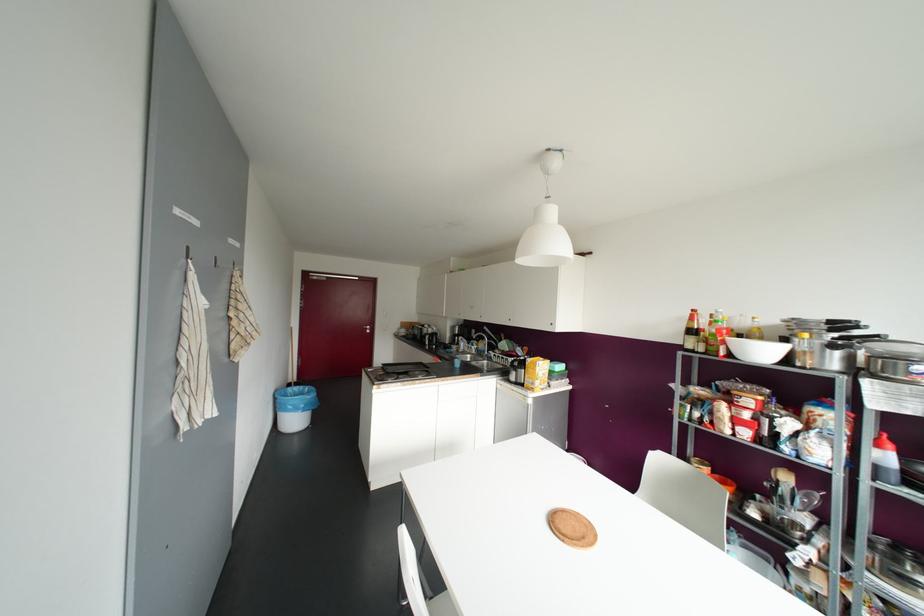
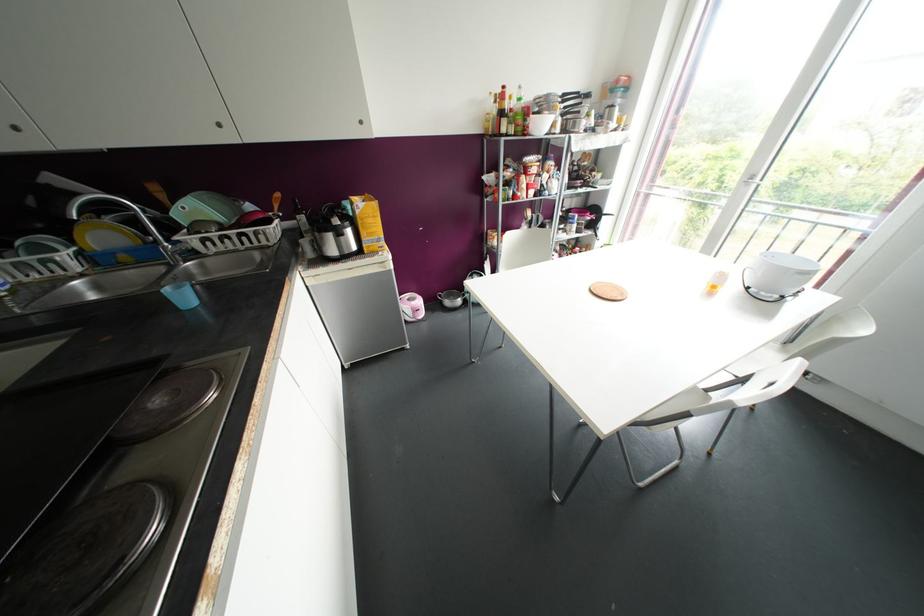
Locate, in the second image, the point that corresponds to the point at 456,363 in the first image.

(184, 297)